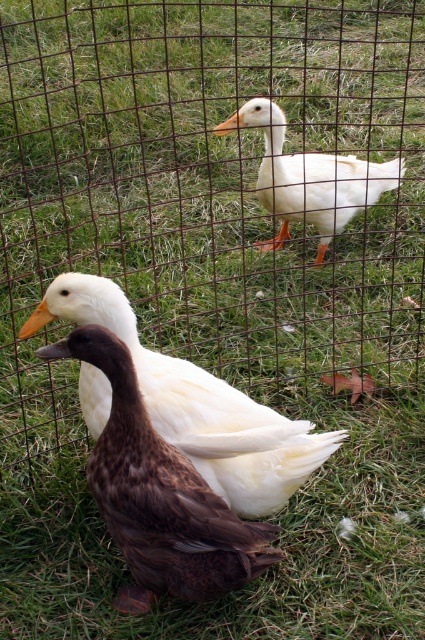
Does point (113, 440) come in front of point (323, 186)?

Yes.

Based on the photo, can you confirm if brown feathered duck at center is shorter than white matte duck at upper center?

No, brown feathered duck at center is not shorter than white matte duck at upper center.

The image size is (425, 640). Identify the location of brown feathered duck at center. (159, 496).

Locate an element on the screen. The image size is (425, 640). brown feathered duck at center is located at coordinates (159, 496).

Between point (146, 584) and point (127, 324), which one is positioned in front?

Positioned in front is point (146, 584).

Does brown feathered duck at center appear on the left side of white matte duck at center?

Correct, you'll find brown feathered duck at center to the left of white matte duck at center.

The image size is (425, 640). What are the coordinates of `brown feathered duck at center` in the screenshot? It's located at (159, 496).

Does white matte duck at center appear on the right side of white matte duck at upper center?

Incorrect, white matte duck at center is not on the right side of white matte duck at upper center.

Consider the image. Is white matte duck at center behind white matte duck at upper center?

No, it is not.

This screenshot has width=425, height=640. Find the location of `white matte duck at center`. white matte duck at center is located at coordinates (198, 406).